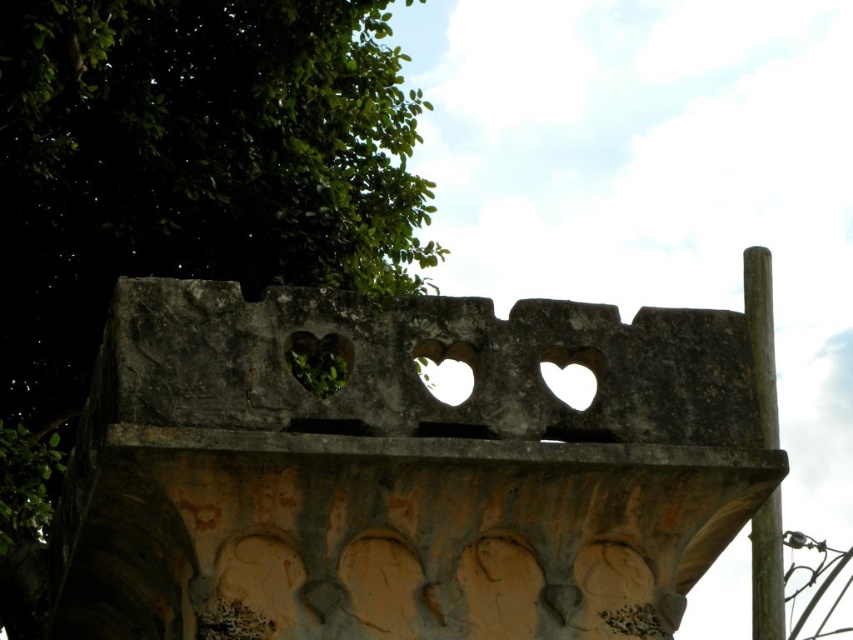
Question: Which point is farther from the camera taking this photo?

Choices:
 (A) (749, 285)
 (B) (148, 266)

Answer: (A)

Question: Is gray stone heart holes at center above brown wood pole at right?

Choices:
 (A) no
 (B) yes

Answer: (B)

Question: Which object appears farthest from the camera in this image?

Choices:
 (A) gray stone heart holes at center
 (B) green leafy tree at upper left

Answer: (B)

Question: Which point is closer to the camera?

Choices:
 (A) (660, 376)
 (B) (779, 589)

Answer: (A)

Question: Does gray stone heart holes at center appear on the left side of brown wood pole at right?

Choices:
 (A) yes
 (B) no

Answer: (A)

Question: Can you confirm if green leafy tree at upper left is positioned above brown wood pole at right?

Choices:
 (A) yes
 (B) no

Answer: (A)